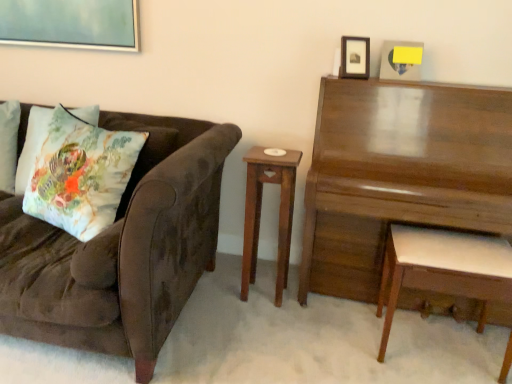
Locate an element on the screen. The image size is (512, 384). vacant space in wooden nightstand at center (from a real-world perspective) is located at coordinates (260, 296).